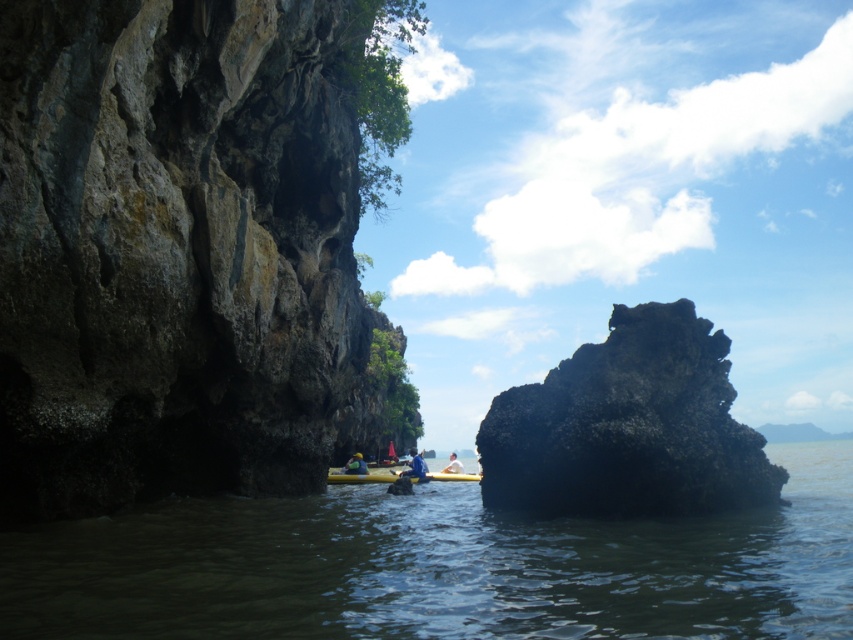
You are planning to kayak in the coastal area shown. The kayak you have is exactly the same size as the matte yellow kayak at center. Can you safely navigate through the greenish murky water at center without getting stuck?

The greenish murky water at center has a larger size compared to matte yellow kayak at center, so yes, you can safely navigate through the greenish murky water at center without getting stuck since the water area is wider than the kayak.

You are a hiker standing at the base of the rough stone cliff at left and the black rough rock at center. You want to climb to the top of the tallest object. Which one should you choose?

You should choose the rough stone cliff at left because it is much taller than the black rough rock at center, making it the tallest object available.